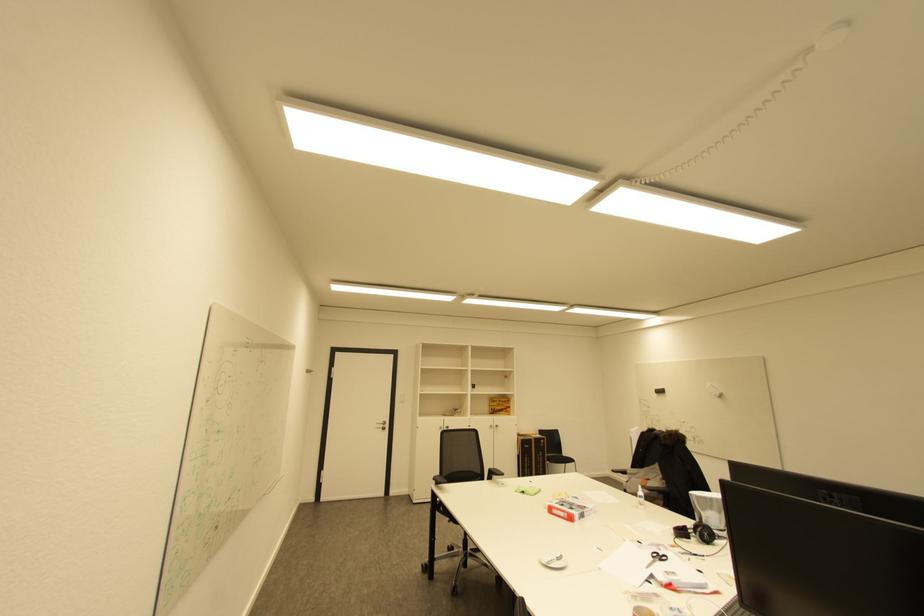
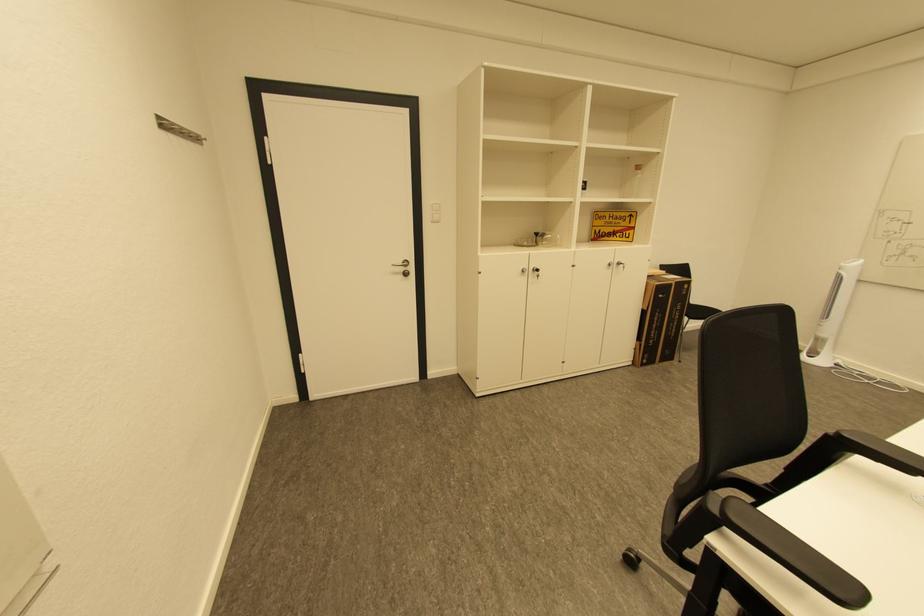
The point at (460, 410) is marked in the first image. Where is the corresponding point in the second image?

(543, 235)